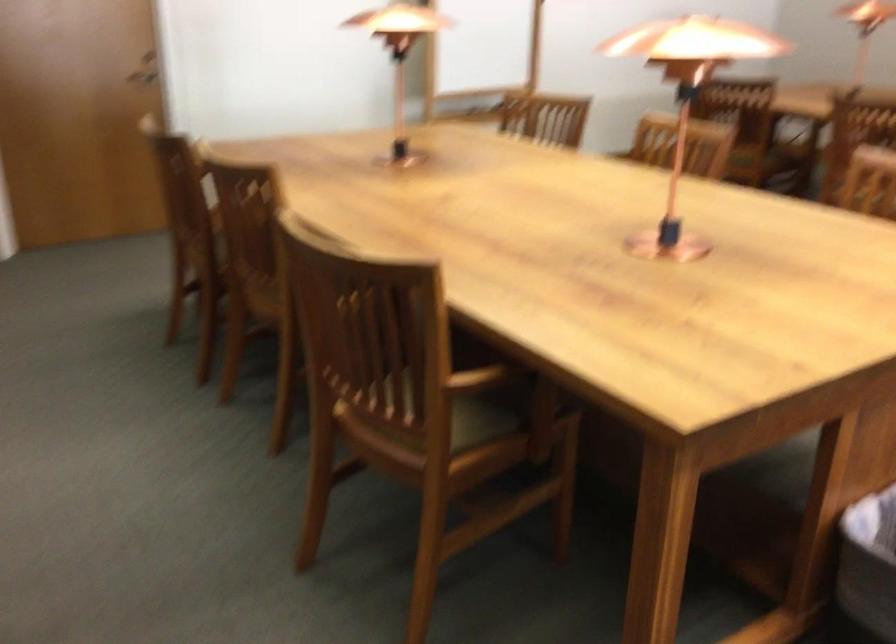
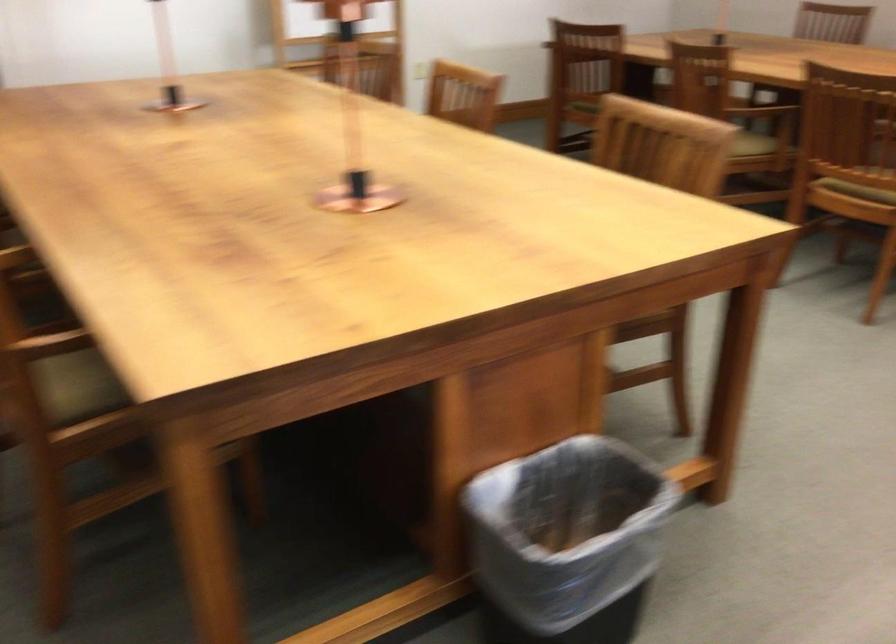
Question: Based on the continuous images, in which direction is the camera rotating? Reply with the corresponding letter.

Choices:
 (A) Left
 (B) Right
 (C) Up
 (D) Down

Answer: (B)